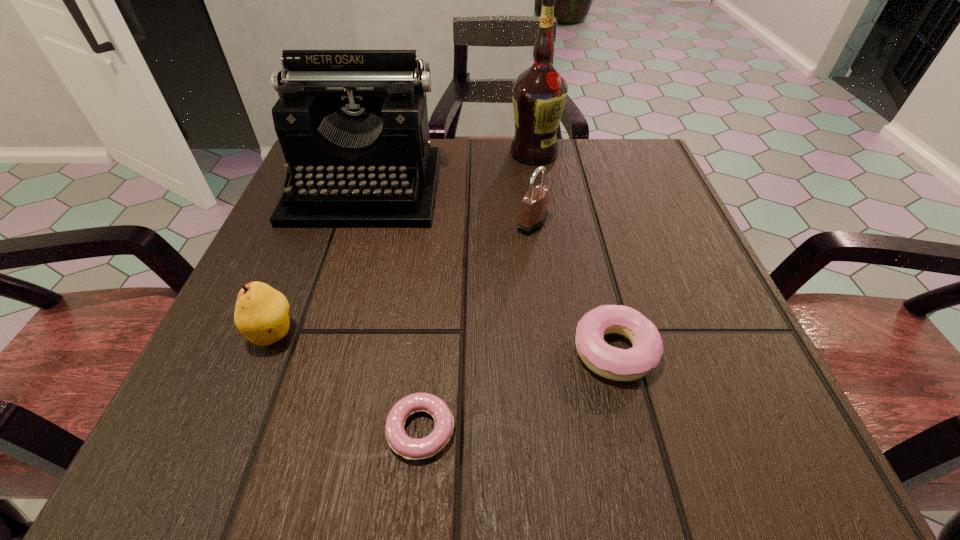
I want to click on vacant region that satisfies the following two spatial constraints: 1. on the typing side of the taller doughnut; 2. on the right side of the typewriter, so click(313, 351).